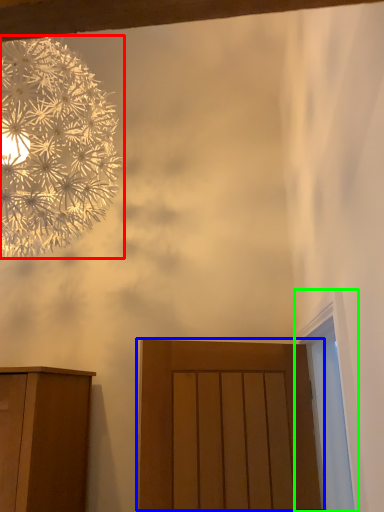
Question: Which is farther away from flower (highlighted by a red box)? door (highlighted by a blue box) or window (highlighted by a green box)?

Choices:
 (A) door
 (B) window

Answer: (B)